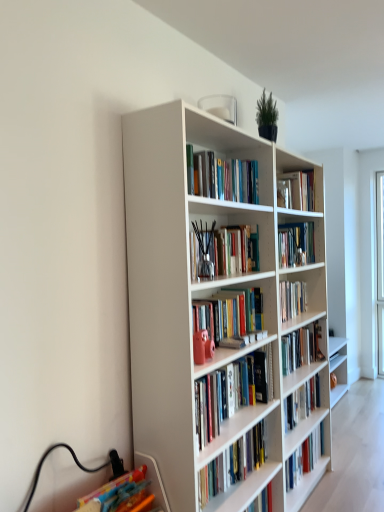
Question: Does white matte bookcase at center turn towards hardcover books at upper center, the second book when ordered from top to bottom?

Choices:
 (A) yes
 (B) no

Answer: (A)

Question: Is the position of white matte bookcase at center more distant than that of hardcover books at upper center, the second book when ordered from top to bottom?

Choices:
 (A) no
 (B) yes

Answer: (A)

Question: Is white matte bookcase at center smaller than hardcover books at upper center, the second book when ordered from top to bottom?

Choices:
 (A) no
 (B) yes

Answer: (A)

Question: From the image's perspective, is white matte bookcase at center beneath hardcover books at upper center, the second book when ordered from top to bottom?

Choices:
 (A) yes
 (B) no

Answer: (A)

Question: Does white matte bookcase at center have a lesser width compared to hardcover books at upper center, which is counted as the third book, starting from the bottom?

Choices:
 (A) yes
 (B) no

Answer: (B)

Question: From the image's perspective, is translucent glass vase at center, the 2th book in the bottom-to-top sequence, positioned above or below white matte bookcase at center?

Choices:
 (A) below
 (B) above

Answer: (B)

Question: Is translucent glass vase at center, the 2th book in the bottom-to-top sequence, bigger or smaller than white matte bookcase at center?

Choices:
 (A) small
 (B) big

Answer: (A)

Question: From a real-world perspective, is translucent glass vase at center, the 2th book in the bottom-to-top sequence, above or below white matte bookcase at center?

Choices:
 (A) above
 (B) below

Answer: (A)

Question: Visually, is translucent glass vase at center, which is counted as the third book, starting from the top, positioned to the left or to the right of white matte bookcase at center?

Choices:
 (A) left
 (B) right

Answer: (A)

Question: From their relative heights in the image, would you say hardcover book at upper center, which appears as the fourth book when ordered from the bottom, is taller or shorter than white matte bookcase at center?

Choices:
 (A) short
 (B) tall

Answer: (A)

Question: Considering the relative positions of hardcover book at upper center, the 1th book viewed from the top, and white matte bookcase at center in the image provided, is hardcover book at upper center, the 1th book viewed from the top, to the left or to the right of white matte bookcase at center?

Choices:
 (A) left
 (B) right

Answer: (B)

Question: Considering the positions of point (281, 176) and point (201, 442), is point (281, 176) closer or farther from the camera than point (201, 442)?

Choices:
 (A) closer
 (B) farther

Answer: (B)

Question: Considering the positions of hardcover book at upper center, the 1th book viewed from the top, and white matte bookcase at center in the image, is hardcover book at upper center, the 1th book viewed from the top, bigger or smaller than white matte bookcase at center?

Choices:
 (A) big
 (B) small

Answer: (B)

Question: From their relative heights in the image, would you say hardcover book at upper center, the 1th book viewed from the top, is taller or shorter than white glossy bookshelf at center, arranged as the 1th book when ordered from the bottom?

Choices:
 (A) tall
 (B) short

Answer: (B)

Question: From a real-world perspective, relative to white glossy bookshelf at center, arranged as the 1th book when ordered from the bottom, is hardcover book at upper center, which appears as the fourth book when ordered from the bottom, vertically above or below?

Choices:
 (A) below
 (B) above

Answer: (B)